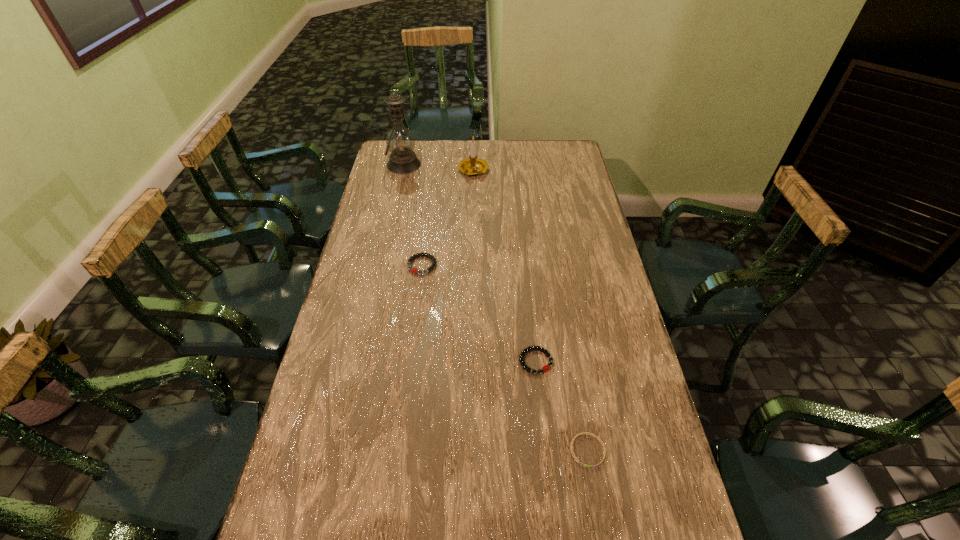
This screenshot has width=960, height=540. What are the coordinates of `the leftmost object` in the screenshot? It's located at (400, 141).

I want to click on oil lamp, so click(400, 141).

Locate an element on the screen. The height and width of the screenshot is (540, 960). the third object from right to left is located at coordinates (472, 166).

At what (x,y) coordinates should I click in order to perform the action: click on the second tallest object. Please return your answer as a coordinate pair (x, y). The height and width of the screenshot is (540, 960). Looking at the image, I should click on (472, 166).

This screenshot has width=960, height=540. In order to click on the fourth object from right to left in this screenshot , I will do `click(434, 262)`.

Locate an element on the screen. The width and height of the screenshot is (960, 540). the farthest bracelet is located at coordinates (434, 262).

What are the coordinates of `the second farthest bracelet` in the screenshot? It's located at (545, 368).

This screenshot has width=960, height=540. In order to click on the second object from right to left in this screenshot , I will do `click(545, 368)`.

I want to click on the shortest object, so click(x=583, y=433).

This screenshot has width=960, height=540. I want to click on the shortest bracelet, so click(583, 433).